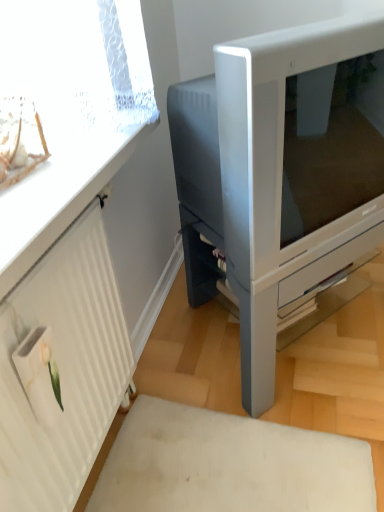
The width and height of the screenshot is (384, 512). What do you see at coordinates (63, 369) in the screenshot?
I see `white textured radiator at left` at bounding box center [63, 369].

Find the location of a particular element. The width and height of the screenshot is (384, 512). satin silver monitor at center is located at coordinates pos(282,170).

The image size is (384, 512). I want to click on white textured radiator at left, so click(x=63, y=369).

From a real-world perspective, is white textured radiator at left positioned above or below clear plastic window screen at upper left?

From a real-world perspective, white textured radiator at left is physically below clear plastic window screen at upper left.

How many degrees apart are the facing directions of white textured radiator at left and clear plastic window screen at upper left?

There is a 1.33-degree angle between the facing directions of white textured radiator at left and clear plastic window screen at upper left.

Where is `window screen on the left of white textured radiator at left`? window screen on the left of white textured radiator at left is located at coordinates (66, 98).

Is there a large distance between white textured radiator at left and satin silver monitor at center?

white textured radiator at left is actually quite close to satin silver monitor at center.

Measure the distance from white textured radiator at left to satin silver monitor at center.

white textured radiator at left is 18.40 inches from satin silver monitor at center.

From a real-world perspective, is white textured radiator at left physically located above or below satin silver monitor at center?

In terms of real-world spatial position, white textured radiator at left is above satin silver monitor at center.

Between white textured radiator at left and satin silver monitor at center, which one has smaller size?

With smaller size is white textured radiator at left.

Can you confirm if satin silver monitor at center is positioned to the right of white textured radiator at left?

Yes.

Is satin silver monitor at center facing away from white textured radiator at left?

That's not correct — satin silver monitor at center is not looking away from white textured radiator at left.

Locate an element on the screen. The height and width of the screenshot is (512, 384). furniture that is under the white textured radiator at left (from a real-world perspective) is located at coordinates click(282, 170).

Measure the distance from satin silver monitor at center to white textured radiator at left.

satin silver monitor at center is 18.40 inches away from white textured radiator at left.

Considering the sizes of objects clear plastic window screen at upper left and satin silver monitor at center in the image provided, who is bigger, clear plastic window screen at upper left or satin silver monitor at center?

satin silver monitor at center.

Between clear plastic window screen at upper left and satin silver monitor at center, which one is positioned behind?

Positioned behind is satin silver monitor at center.

Considering the relative sizes of clear plastic window screen at upper left and satin silver monitor at center in the image provided, is clear plastic window screen at upper left taller than satin silver monitor at center?

No.

From a real-world perspective, relative to satin silver monitor at center, is clear plastic window screen at upper left vertically above or below?

Clearly, from a real-world perspective, clear plastic window screen at upper left is above satin silver monitor at center.

Can you see clear plastic window screen at upper left touching white textured radiator at left?

They are not placed beside each other.

Is clear plastic window screen at upper left smaller than white textured radiator at left?

Correct, clear plastic window screen at upper left occupies less space than white textured radiator at left.

Does clear plastic window screen at upper left have a greater width compared to white textured radiator at left?

Correct, the width of clear plastic window screen at upper left exceeds that of white textured radiator at left.

Considering the sizes of clear plastic window screen at upper left and white textured radiator at left in the image, is clear plastic window screen at upper left taller or shorter than white textured radiator at left?

In the image, clear plastic window screen at upper left appears to be shorter than white textured radiator at left.

How different are the orientations of satin silver monitor at center and clear plastic window screen at upper left in degrees?

satin silver monitor at center and clear plastic window screen at upper left are facing 38.8 degrees away from each other.

Does point (257, 91) appear closer or farther from the camera than point (65, 25)?

Point (257, 91).

Is satin silver monitor at center not within clear plastic window screen at upper left?

Yes.

You are a GUI agent. You are given a task and a screenshot of the screen. Output one action in this format:
    pyautogui.click(x=<x>, y=<y>)
    Task: Click on the radiator that is in front of the clear plastic window screen at upper left
    This screenshot has height=512, width=384.
    Given the screenshot: What is the action you would take?
    pyautogui.click(x=63, y=369)

Where is `radiator that is below the satin silver monitor at center (from the image's perspective)`? The height and width of the screenshot is (512, 384). radiator that is below the satin silver monitor at center (from the image's perspective) is located at coordinates (x=63, y=369).

When comparing their distances from satin silver monitor at center, does white textured radiator at left or clear plastic window screen at upper left seem closer?

Based on the image, clear plastic window screen at upper left appears to be nearer to satin silver monitor at center.

When comparing their distances from clear plastic window screen at upper left, does white textured radiator at left or satin silver monitor at center seem further?

satin silver monitor at center lies further to clear plastic window screen at upper left than the other object.

Based on their spatial positions, is clear plastic window screen at upper left or satin silver monitor at center further from white textured radiator at left?

Among the two, satin silver monitor at center is located further to white textured radiator at left.

Considering their positions, is clear plastic window screen at upper left positioned closer to satin silver monitor at center than white textured radiator at left?

clear plastic window screen at upper left lies closer to satin silver monitor at center than the other object.

From the image, which object appears to be farther from white textured radiator at left, satin silver monitor at center or clear plastic window screen at upper left?

The object further to white textured radiator at left is satin silver monitor at center.

Considering their positions, is satin silver monitor at center positioned closer to clear plastic window screen at upper left than white textured radiator at left?

white textured radiator at left lies closer to clear plastic window screen at upper left than the other object.

Identify the location of radiator between clear plastic window screen at upper left and satin silver monitor at center in the horizontal direction. The width and height of the screenshot is (384, 512). point(63,369).